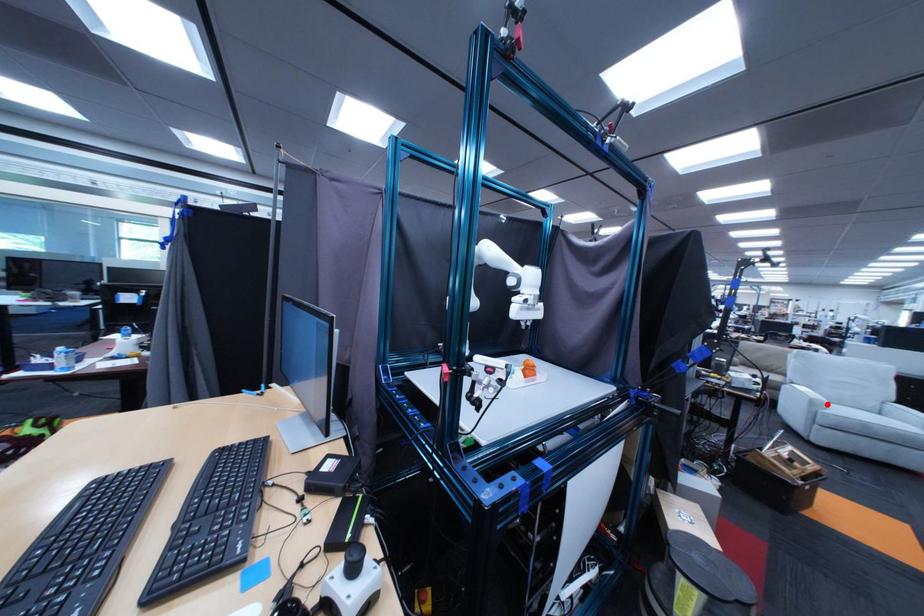
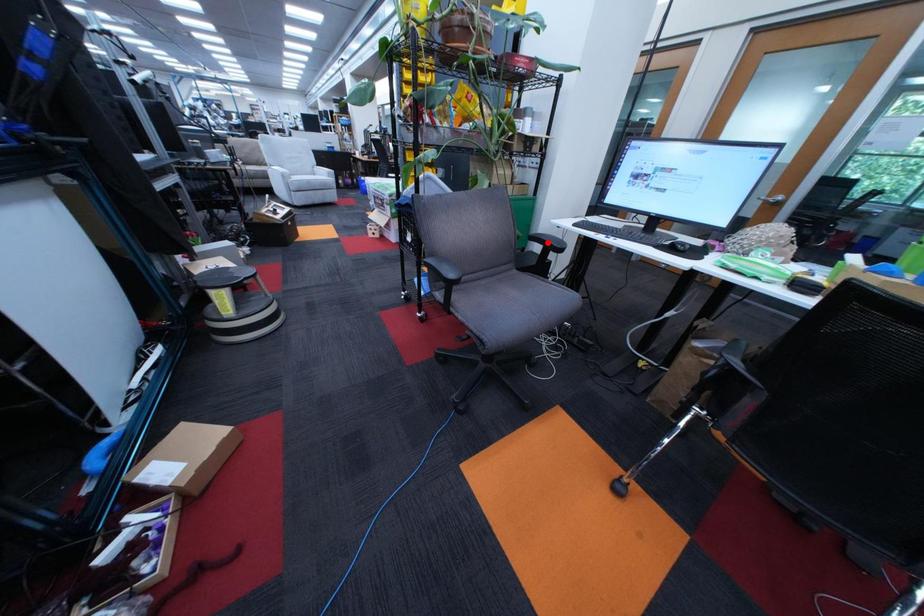
I am providing you with two images of the same scene from different viewpoints. A red point is marked on the first image and another point is marked on the second image. Does the point marked in image1 correspond to the same location as the one in image2?

No